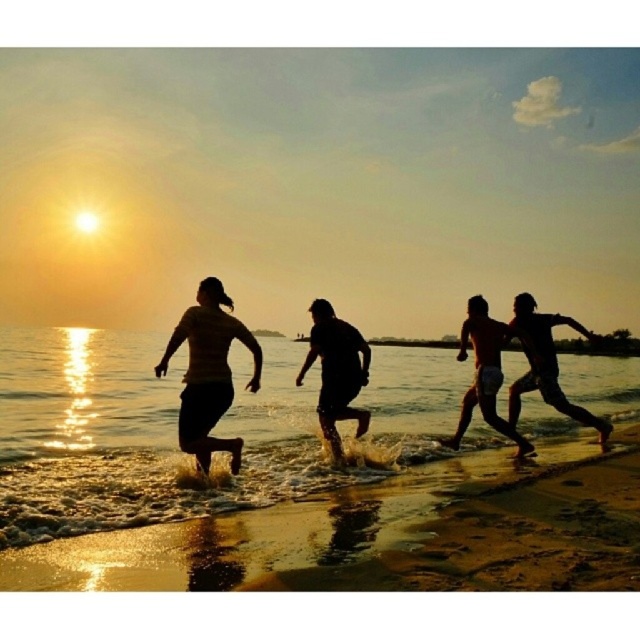
Question: Does matte yellow shirt at center have a lesser width compared to silhouette running man at right?

Choices:
 (A) yes
 (B) no

Answer: (B)

Question: Estimate the real-world distances between objects in this image. Which object is closer to the dark matte figure at center?

Choices:
 (A) matte yellow shirt at center
 (B) sandy beach at lower right
 (C) smooth skin torso at center

Answer: (A)

Question: Does matte yellow shirt at center have a lesser width compared to smooth skin torso at center?

Choices:
 (A) no
 (B) yes

Answer: (B)

Question: Estimate the real-world distances between objects in this image. Which object is closer to the sandy beach at lower right?

Choices:
 (A) dark matte figure at center
 (B) matte yellow shirt at center
 (C) smooth skin torso at center

Answer: (B)

Question: Which of the following is the closest to the observer?

Choices:
 (A) (324, 314)
 (B) (417, 500)
 (C) (608, 435)

Answer: (B)

Question: Can you confirm if matte yellow shirt at center is smaller than silhouette running man at right?

Choices:
 (A) no
 (B) yes

Answer: (A)